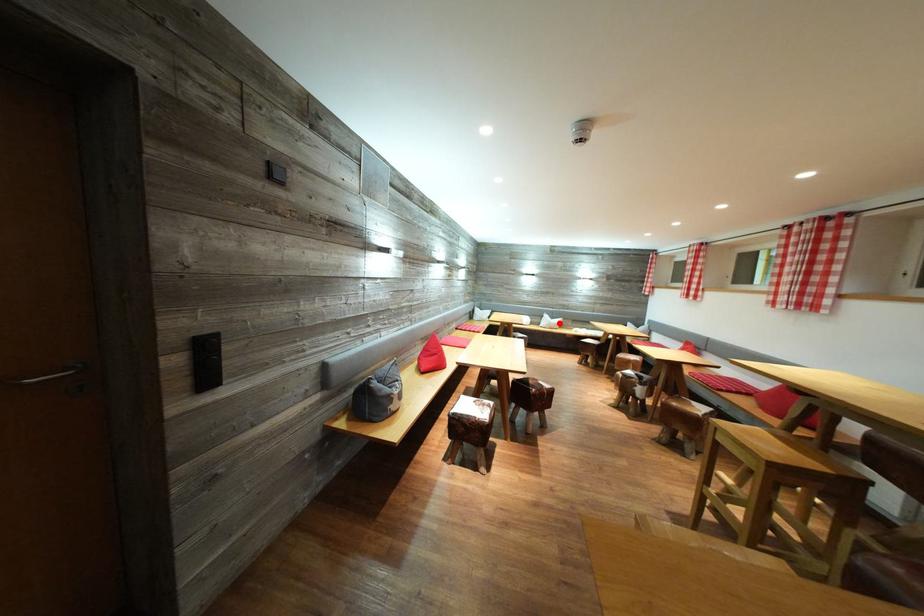
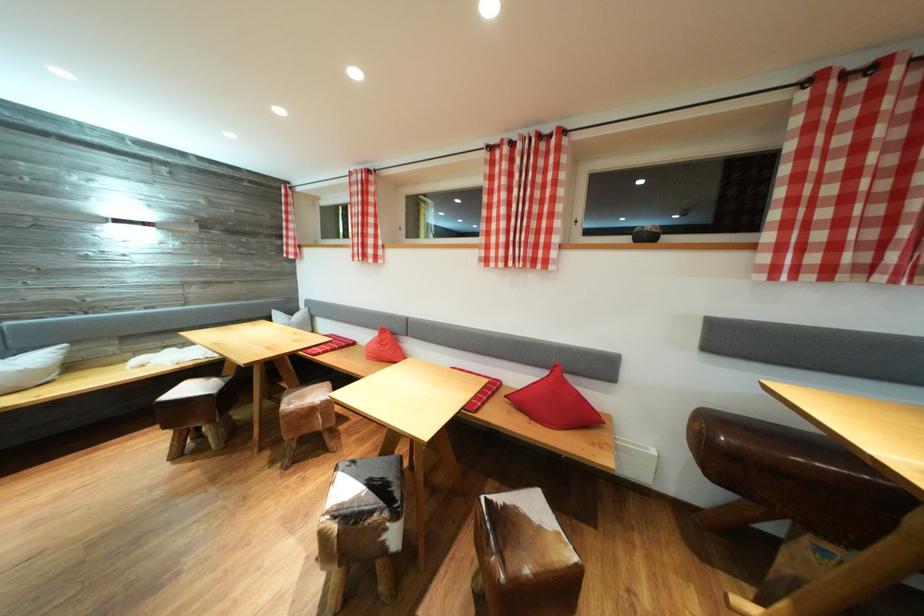
Locate, in the second image, the point that corresponds to the highlighted location in the first image.

(14, 358)